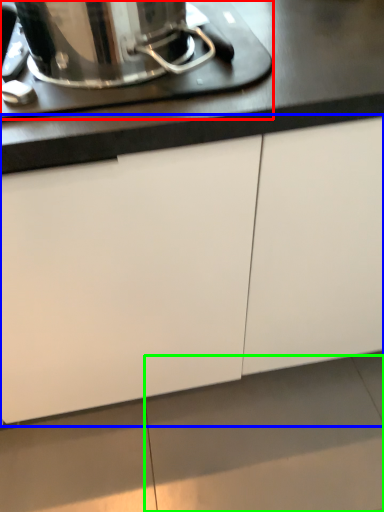
Question: Based on their relative distances, which object is nearer to home appliance (highlighted by a red box)? Choose from cabinetry (highlighted by a blue box) and tile (highlighted by a green box).

Choices:
 (A) cabinetry
 (B) tile

Answer: (A)